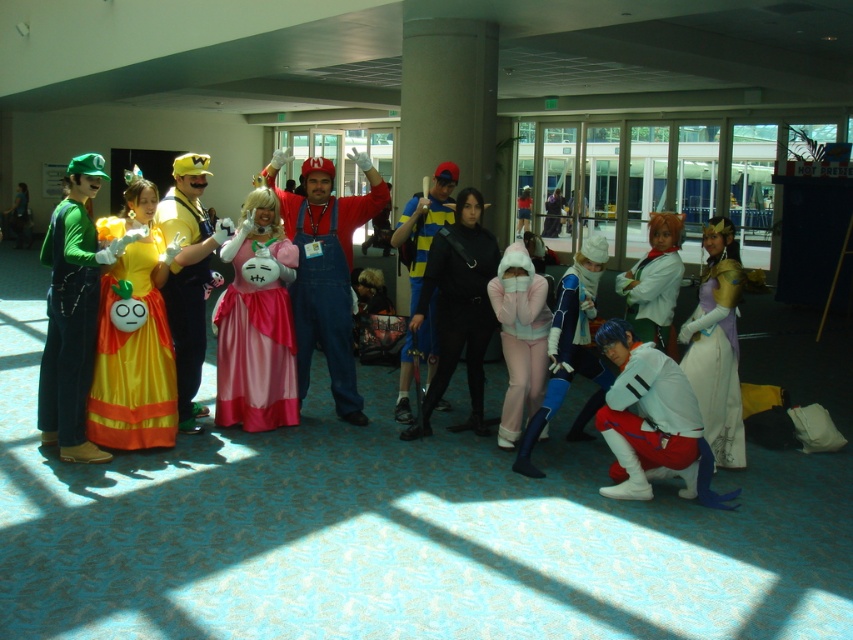
Which is below, matte pink dress at center or matte red overalls at center?

matte pink dress at center

Does point (113, 324) come behind point (354, 221)?

No, (113, 324) is closer to viewer.

Which is behind, point (132, 371) or point (366, 220)?

Point (366, 220)

Image resolution: width=853 pixels, height=640 pixels. In order to click on matte pink dress at center in this screenshot , I will do `click(126, 333)`.

Does green matte luigi costume at left appear over white satin dress at center?

Correct, green matte luigi costume at left is located above white satin dress at center.

At what (x,y) coordinates should I click in order to perform the action: click on green matte luigi costume at left. Please return your answer as a coordinate pair (x, y). The height and width of the screenshot is (640, 853). Looking at the image, I should click on (73, 314).

Identify the location of green matte luigi costume at left. The image size is (853, 640). (73, 314).

Is the position of pink satin dress at center more distant than that of white satin dress at center?

Yes.

Between point (288, 385) and point (654, 284), which one is positioned in front?

Point (654, 284)

Find the location of a particular element. The height and width of the screenshot is (640, 853). pink satin dress at center is located at coordinates (256, 333).